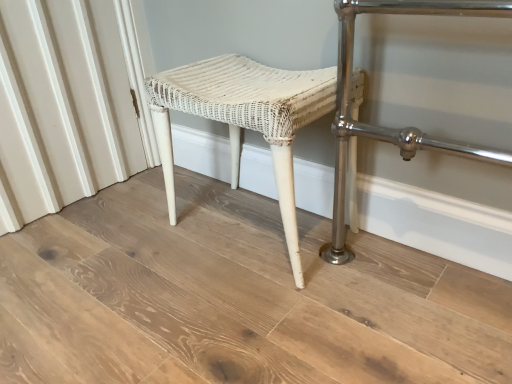
What is the approximate width of white wicker stool at center?

It is 12.54 inches.

What do you see at coordinates (244, 118) in the screenshot?
I see `white wicker stool at center` at bounding box center [244, 118].

Identify the location of white wicker stool at center. This screenshot has width=512, height=384. (244, 118).

Locate an element on the screen. This screenshot has width=512, height=384. white wicker stool at center is located at coordinates (244, 118).